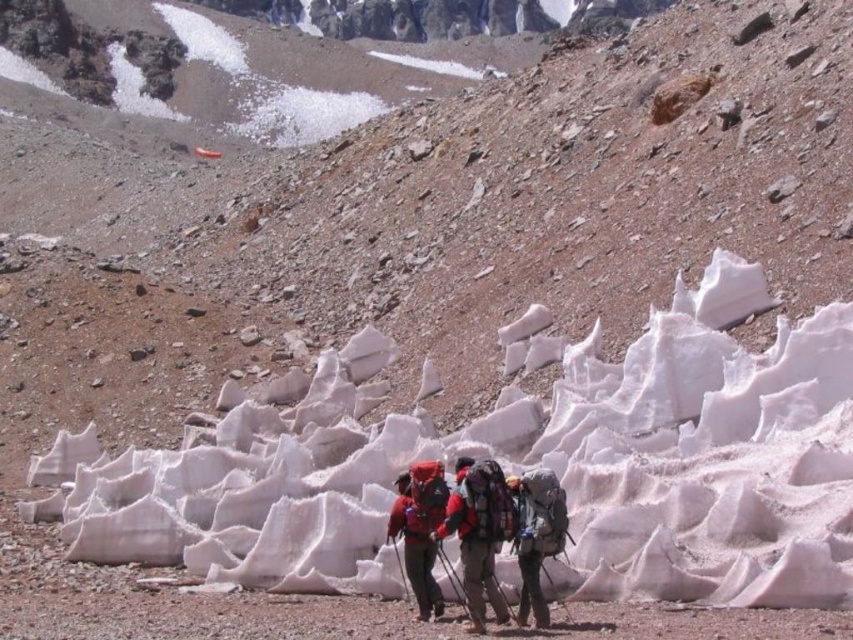
Can you confirm if red fabric jacket at center is taller than matte red jacket at center?

Indeed, red fabric jacket at center has a greater height compared to matte red jacket at center.

Does point (486, 531) come behind point (390, 520)?

No, (486, 531) is closer to viewer.

Between point (508, 618) and point (401, 490), which one is positioned behind?

The point (401, 490) is behind.

The height and width of the screenshot is (640, 853). I want to click on red fabric jacket at center, so click(x=479, y=532).

Which is more to the right, matte red jacket at center or matte gray backpack at center?

matte gray backpack at center is more to the right.

Locate an element on the screen. The image size is (853, 640). matte red jacket at center is located at coordinates (421, 529).

Is the position of red fabric jacket at center less distant than that of matte gray backpack at center?

That is True.

Is point (467, 579) in front of point (527, 477)?

Yes, point (467, 579) is closer to viewer.

Is point (477, 556) behind point (543, 506)?

No, it is in front of (543, 506).

Where is `red fabric jacket at center`? The width and height of the screenshot is (853, 640). red fabric jacket at center is located at coordinates (479, 532).